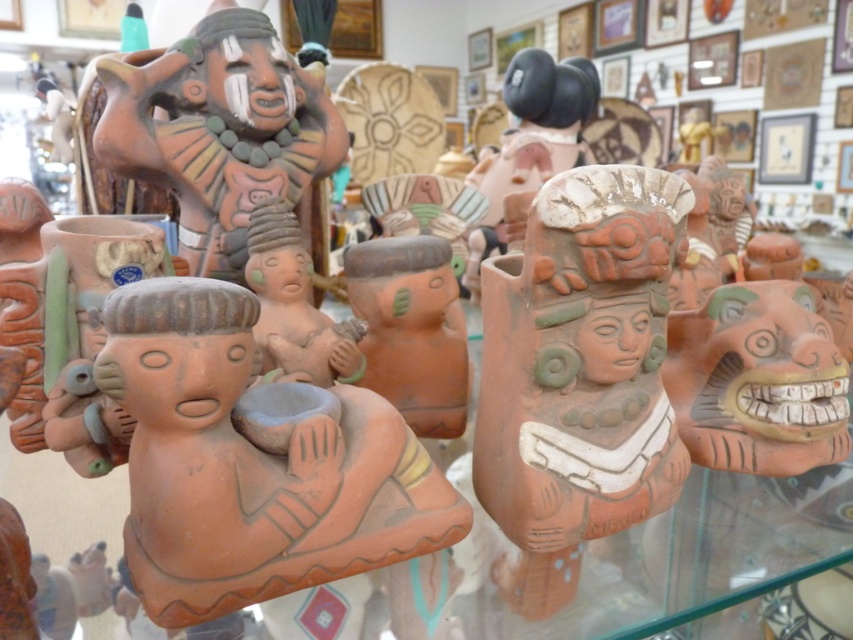
You are a curator organizing an exhibition and need to place the terracotta clay figure at center and the matte clay figurine at center on a shelf. Given their sizes, which one should you place first to ensure both fit properly?

The terracotta clay figure at center occupies less space than the matte clay figurine at center, so you should place the matte clay figurine at center first to ensure both fit properly.

You are an art curator examining the displayed ceramic figurines. You need to locate the terracotta clay figure at center. Where exactly is it positioned in the scene?

The terracotta clay figure at center is positioned at point coordinates of 0.722 on the x axis and 0.297 on the y axis.